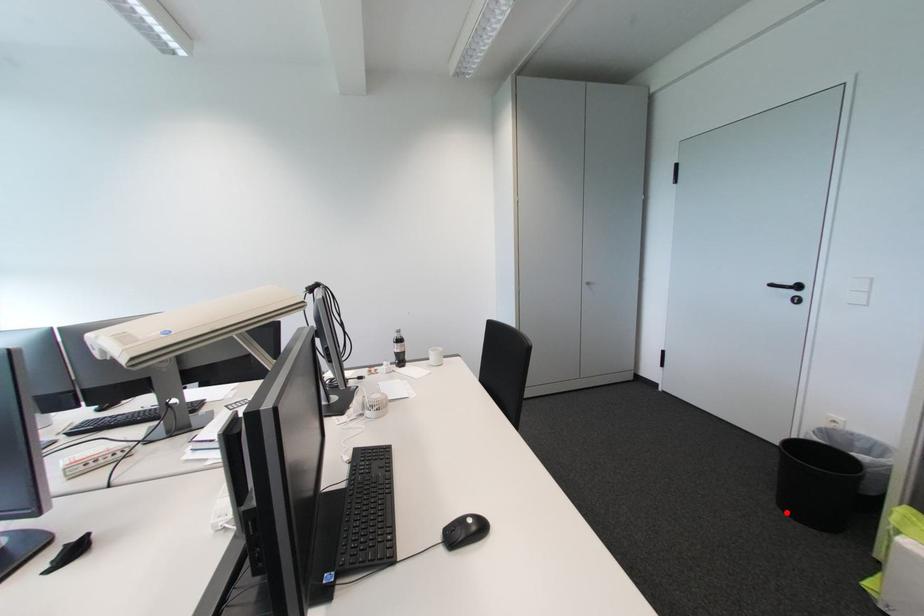
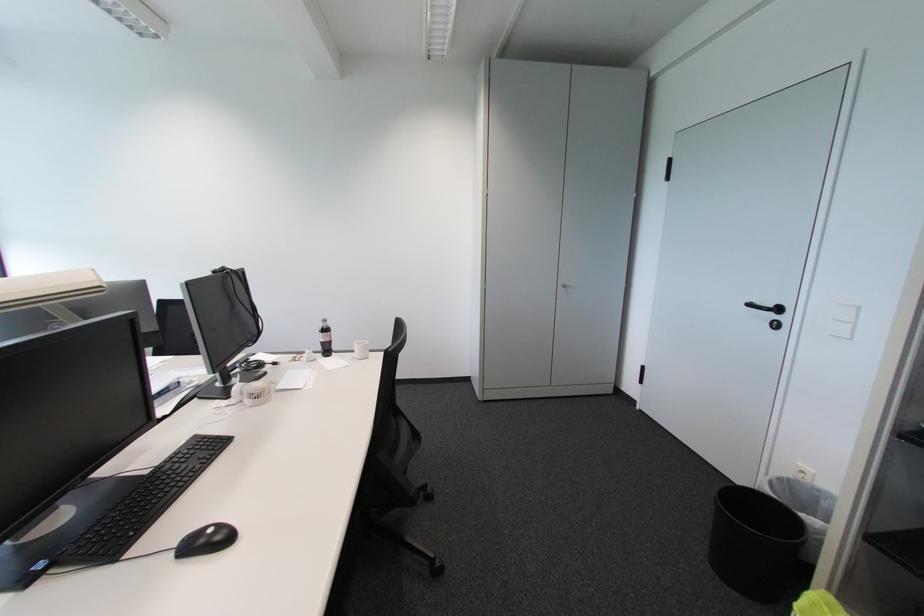
Question: I am providing you with two images of the same scene from different viewpoints. In image1, a red point is highlighted. Considering the same 3D point in image2, which of the following is correct?

Choices:
 (A) It is closer
 (B) It is farther

Answer: (A)